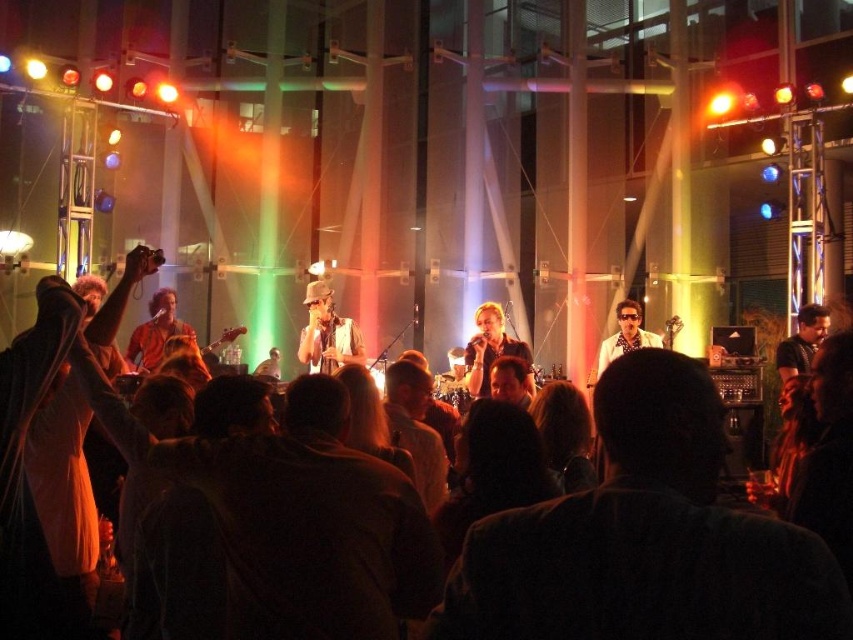
You are a stagehand at the concert venue and need to place a new microphone stand. The stand is 1.2 meters tall. There is a dark brown leather jacket at lower center located at point (645,538). The stage has a height restriction of 1.5 meters. Can the microphone stand be placed at that point without violating the height restriction?

The dark brown leather jacket at lower center is located at point (645,538). The microphone stand is 1.2 meters tall, which is under the 1.5 meters height restriction, so it can be placed there.

You are a stagehand carrying a 10 feet long ladder that needs to be placed between the matte gray harmonica at center and the white glossy shirt at center. Can the ladder fit between them without overlapping either object?

The distance between the matte gray harmonica at center and the white glossy shirt at center is 9.05 feet. Since the ladder is 10 feet long, it cannot fit between them without overlapping either object because the ladder is longer than the available space.

From the picture: You are a photographer in the front row of this concert. You want to take a photo that includes both the dark brown leather jacket at lower center and the matte gray harmonica at center. Which object will appear larger in your photo?

The dark brown leather jacket at lower center will appear larger in the photo because it is closer to the viewer than the matte gray harmonica at center.